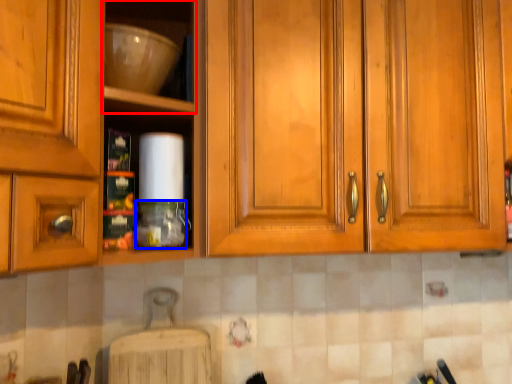
Question: Which object is closer to the camera taking this photo, shelf (highlighted by a red box) or bottle (highlighted by a blue box)?

Choices:
 (A) shelf
 (B) bottle

Answer: (A)